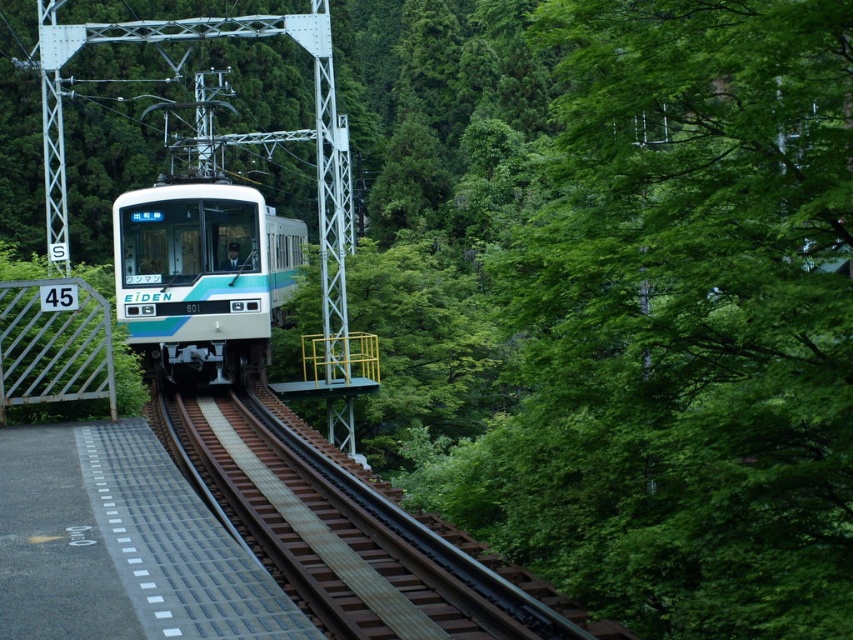
Is brown wooden train track at center positioned at the back of teal glossy train at center?

No, it is not.

Between brown wooden train track at center and teal glossy train at center, which one is positioned higher?

teal glossy train at center is above.

This screenshot has width=853, height=640. Find the location of `brown wooden train track at center`. brown wooden train track at center is located at coordinates (340, 532).

The height and width of the screenshot is (640, 853). What are the coordinates of `brown wooden train track at center` in the screenshot? It's located at (340, 532).